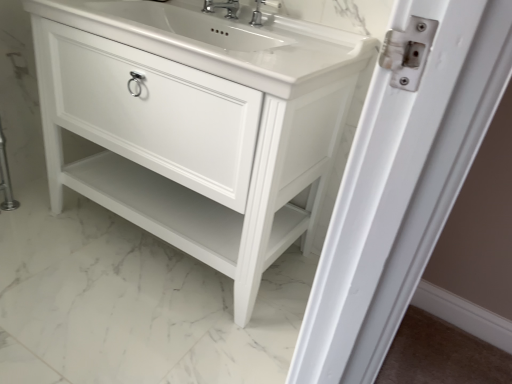
At what (x,y) coordinates should I click in order to perform the action: click on vacant area to the right of polished chrome faucet at upper center, the 2th tap from the right. Please return your answer as a coordinate pair (x, y). Looking at the image, I should click on (262, 32).